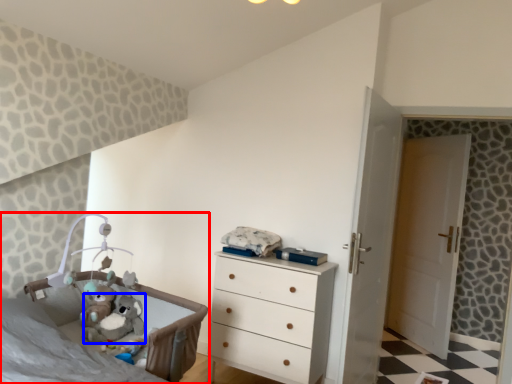
Question: Which object appears closest to the camera in this image, infant bed (highlighted by a red box) or animal (highlighted by a blue box)?

Choices:
 (A) infant bed
 (B) animal

Answer: (A)